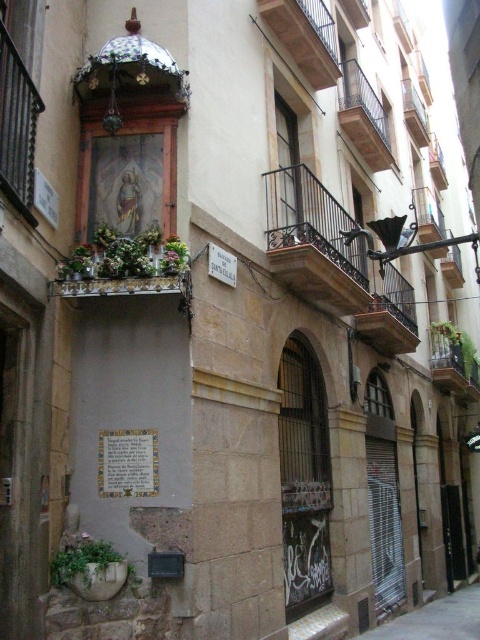
Between rustic wrought iron balcony at center and white paper plaque at center, which one appears on the right side from the viewer's perspective?

rustic wrought iron balcony at center

Does rustic wrought iron balcony at center appear under white paper plaque at center?

Incorrect, rustic wrought iron balcony at center is not positioned below white paper plaque at center.

Locate an element on the screen. rustic wrought iron balcony at center is located at coordinates click(313, 243).

Where is `rustic wrought iron balcony at center`? The height and width of the screenshot is (640, 480). rustic wrought iron balcony at center is located at coordinates (313, 243).

Which is more to the right, rustic wrought iron balcony at center or brown wooden balcony at upper center?

rustic wrought iron balcony at center is more to the right.

Does rustic wrought iron balcony at center appear on the right side of brown wooden balcony at upper center?

Indeed, rustic wrought iron balcony at center is positioned on the right side of brown wooden balcony at upper center.

Find the location of a particular element. rustic wrought iron balcony at center is located at coordinates (313, 243).

The height and width of the screenshot is (640, 480). I want to click on rustic wrought iron balcony at center, so tap(313, 243).

Who is positioned more to the right, white paper plaque at center or rustic wood balcony at upper center?

Positioned to the right is rustic wood balcony at upper center.

Does white paper plaque at center have a lesser width compared to rustic wood balcony at upper center?

Yes, white paper plaque at center is thinner than rustic wood balcony at upper center.

Is point (120, 435) positioned in front of point (349, 129)?

Yes, it is in front of point (349, 129).

Where is `white paper plaque at center`? The width and height of the screenshot is (480, 640). white paper plaque at center is located at coordinates click(x=128, y=464).